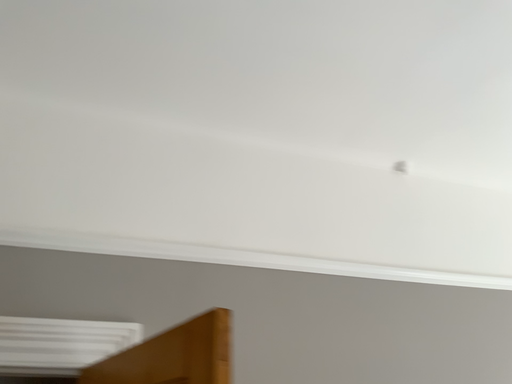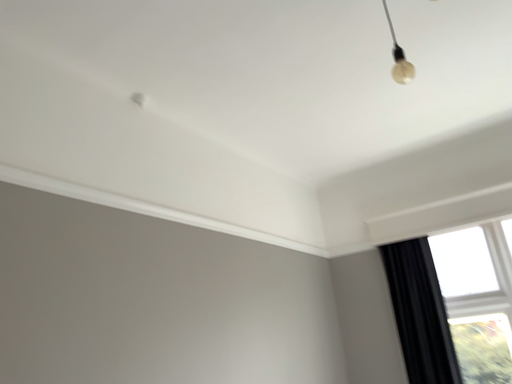
Question: How did the camera likely rotate when shooting the video?

Choices:
 (A) rotated downward
 (B) rotated upward

Answer: (A)